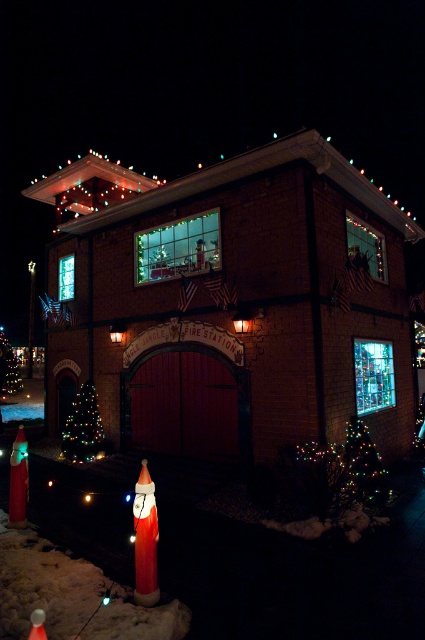
Is multicolored lights at lower right to the left of green matte christmas tree at lower left from the viewer's perspective?

Incorrect, multicolored lights at lower right is not on the left side of green matte christmas tree at lower left.

Is point (316, 502) positioned before point (87, 419)?

Yes, it is in front of point (87, 419).

Based on the photo, measure the distance between multicolored lights at lower right and camera.

multicolored lights at lower right is 24.95 feet from camera.

The image size is (425, 640). I want to click on multicolored lights at lower right, so click(x=342, y=472).

Does smooth wooden garage door at center have a greater width compared to green matte christmas tree at lower left?

Correct, the width of smooth wooden garage door at center exceeds that of green matte christmas tree at lower left.

Between smooth wooden garage door at center and green matte christmas tree at lower left, which one has less height?

With less height is green matte christmas tree at lower left.

The width and height of the screenshot is (425, 640). What do you see at coordinates (186, 404) in the screenshot?
I see `smooth wooden garage door at center` at bounding box center [186, 404].

In order to click on smooth wooden garage door at center in this screenshot , I will do [186, 404].

Based on the photo, can you confirm if smooth wooden garage door at center is positioned to the left of multicolored lights at lower right?

Correct, you'll find smooth wooden garage door at center to the left of multicolored lights at lower right.

Does smooth wooden garage door at center have a larger size compared to multicolored lights at lower right?

Yes.

Is point (153, 442) positioned after point (359, 468)?

That is True.

Identify the location of smooth wooden garage door at center. (186, 404).